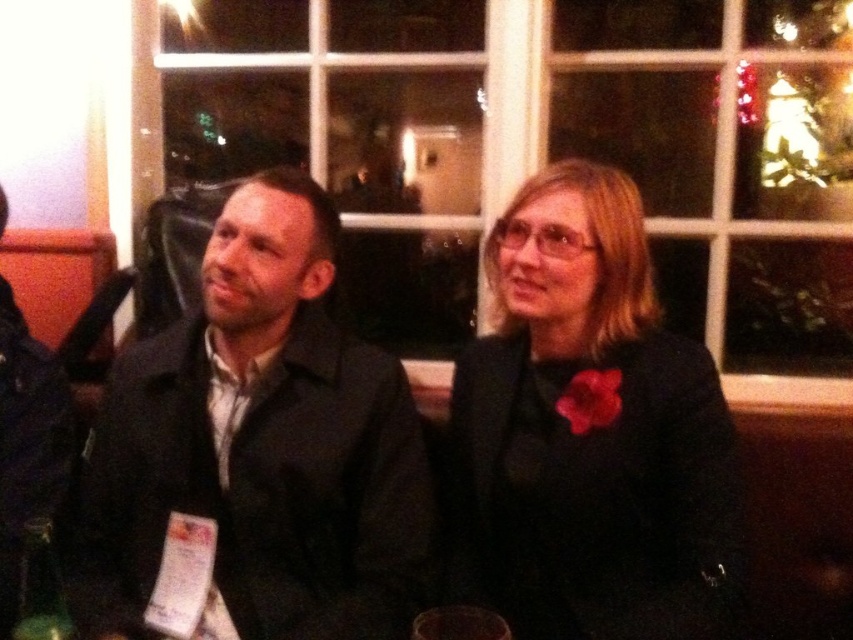
Does matte black jacket at left appear on the right side of matte black jacket at center?

Incorrect, matte black jacket at left is not on the right side of matte black jacket at center.

Does point (303, 630) lie behind point (572, 237)?

No, (303, 630) is in front of (572, 237).

You are a GUI agent. You are given a task and a screenshot of the screen. Output one action in this format:
    pyautogui.click(x=<x>, y=<y>)
    Task: Click on the matte black jacket at left
    
    Given the screenshot: What is the action you would take?
    pyautogui.click(x=262, y=444)